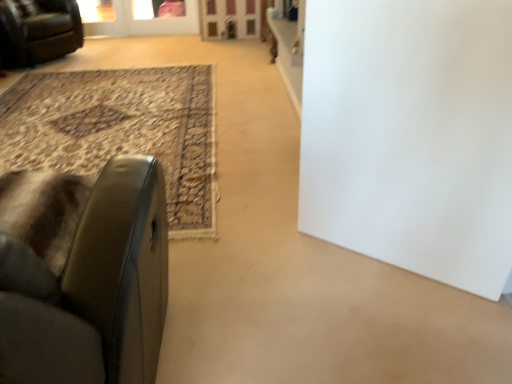
Question: Considering the positions of point (31, 331) and point (123, 1), is point (31, 331) closer or farther from the camera than point (123, 1)?

Choices:
 (A) farther
 (B) closer

Answer: (B)

Question: Visually, is leather at left, which appears as the first chair when viewed from the front, positioned to the left or to the right of transparent glass screen door at upper center, marked as the 1th screen door in a left-to-right arrangement?

Choices:
 (A) left
 (B) right

Answer: (B)

Question: Based on their relative distances, which object is farther from the white matte door at center?

Choices:
 (A) wooden screen door at upper center, the 1th screen door when ordered from right to left
 (B) transparent glass screen door at upper center, marked as the 1th screen door in a left-to-right arrangement
 (C) leather couch at upper left, placed as the 1th chair when sorted from top to bottom
 (D) leather at left, the 2th chair in the back-to-front sequence

Answer: (B)

Question: Which object is positioned closest to the white matte door at center?

Choices:
 (A) leather at left, the 2th chair in the back-to-front sequence
 (B) leather couch at upper left, acting as the second chair starting from the right
 (C) transparent glass screen door at upper center, positioned as the 2th screen door in right-to-left order
 (D) wooden screen door at upper center, arranged as the 2th screen door when viewed from the left

Answer: (A)